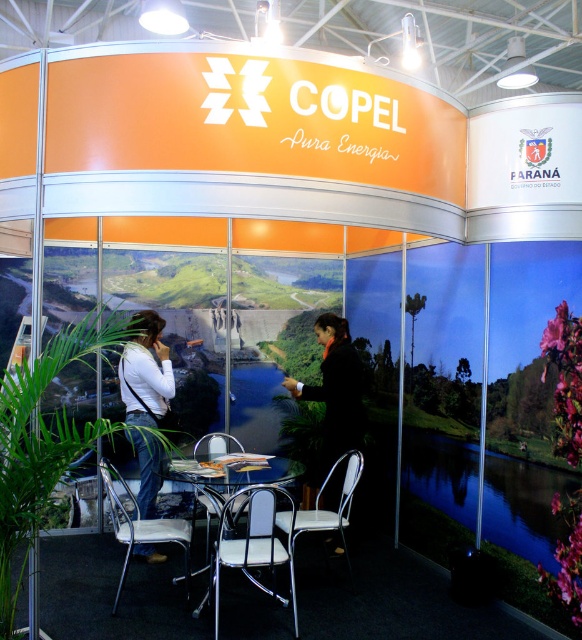
Question: Can you confirm if black fabric coat at center is wider than white metal chair at lower left?

Choices:
 (A) yes
 (B) no

Answer: (B)

Question: Considering the real-world distances, which object is closest to the white matte shirt at center?

Choices:
 (A) white metal chair at lower left
 (B) chrome/chrome chair at center

Answer: (A)

Question: Which of these objects is positioned farthest from the metallic silver chair at center?

Choices:
 (A) white matte shirt at center
 (B) chrome/chrome chair at center

Answer: (A)

Question: Does white matte shirt at center have a larger size compared to black fabric coat at center?

Choices:
 (A) yes
 (B) no

Answer: (B)

Question: Is chrome/chrome chair at center closer to the viewer compared to white metal chair at lower left?

Choices:
 (A) yes
 (B) no

Answer: (A)

Question: Which object appears closest to the camera in this image?

Choices:
 (A) black fabric coat at center
 (B) metallic silver chair at center

Answer: (B)